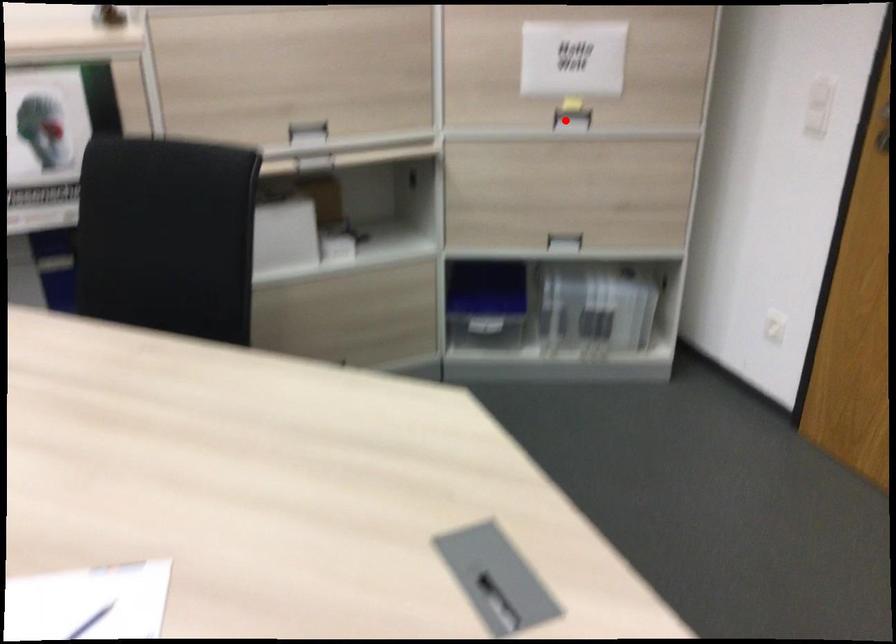
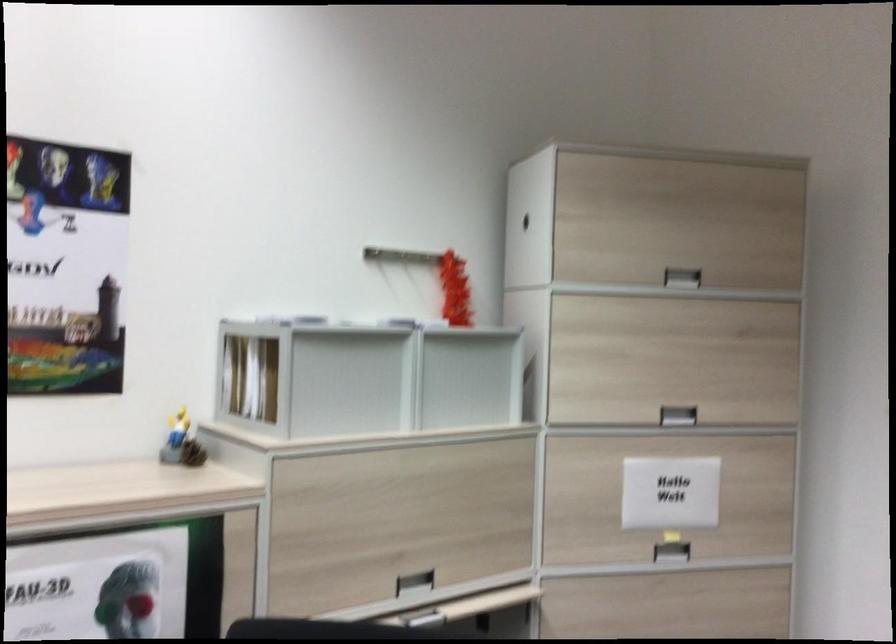
Where in the second image is the point corresponding to the highlighted location from the first image?

(670, 552)